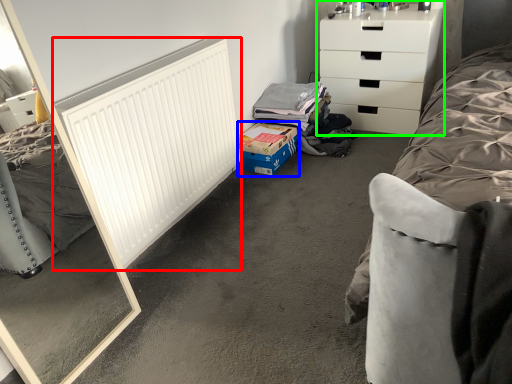
Question: Which object is positioned closest to radiator (highlighted by a red box)? Select from cardboard box (highlighted by a blue box) and chest of drawers (highlighted by a green box).

Choices:
 (A) cardboard box
 (B) chest of drawers

Answer: (A)